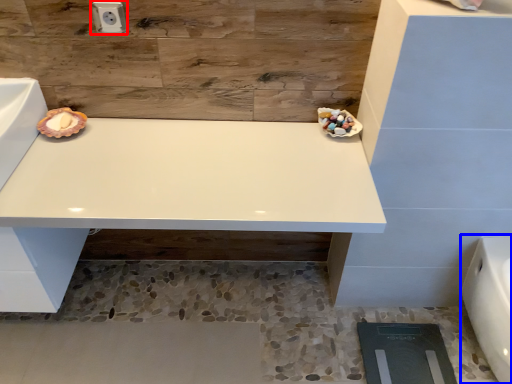
Question: Which point is closer to the camera, electric outlet (highlighted by a red box) or porcelain (highlighted by a blue box)?

Choices:
 (A) electric outlet
 (B) porcelain

Answer: (B)